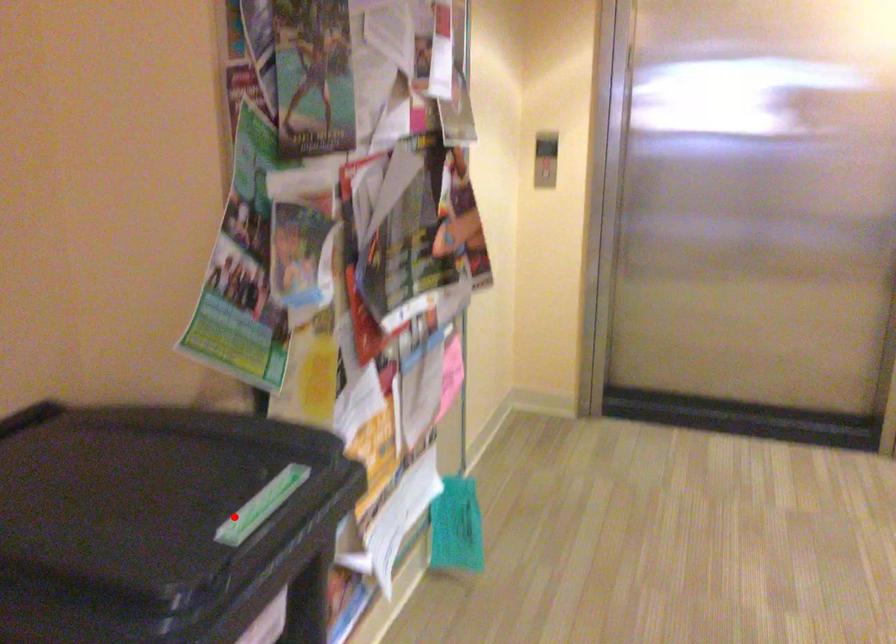
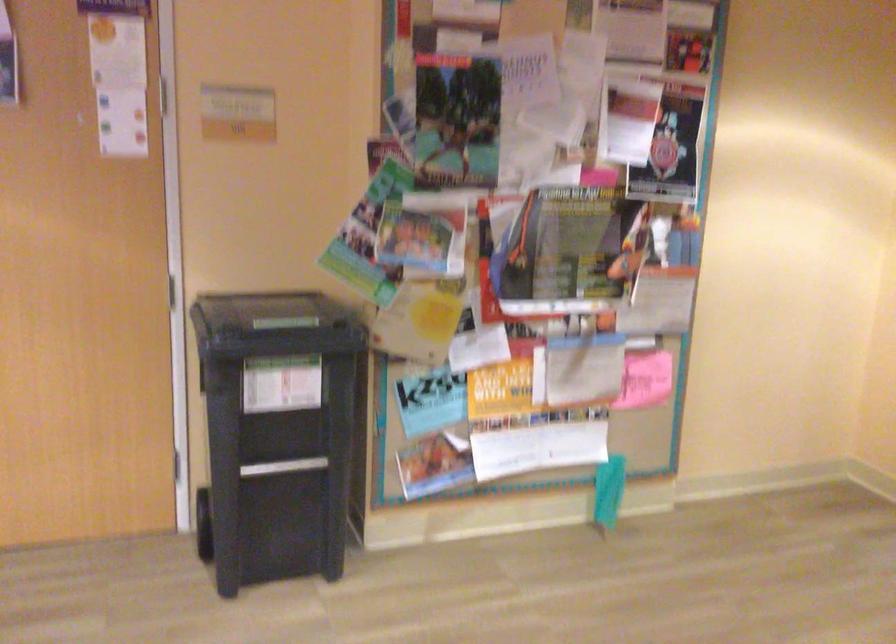
Question: I am providing you with two images of the same scene from different viewpoints. Given a red point in image1, look at the same physical point in image2. Is it:

Choices:
 (A) Closer to the viewpoint
 (B) Farther from the viewpoint

Answer: (B)